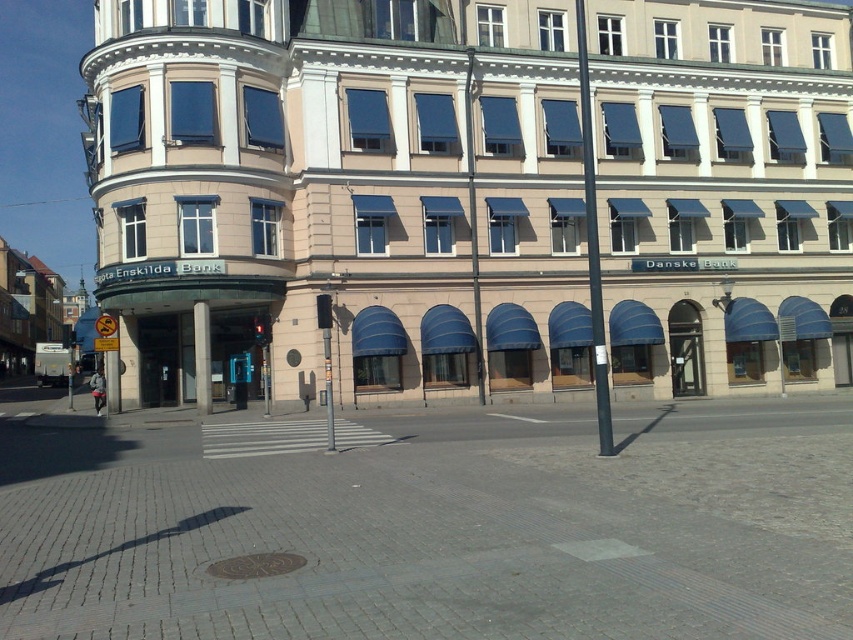
Question: Which point is closer to the camera taking this photo?

Choices:
 (A) (686, 371)
 (B) (697, 554)

Answer: (B)

Question: In this image, where is beige stone building at center located relative to gray concrete sidewalk at center?

Choices:
 (A) above
 (B) below

Answer: (A)

Question: Is beige stone building at center wider than gray concrete sidewalk at center?

Choices:
 (A) yes
 (B) no

Answer: (A)

Question: Does beige stone building at center have a larger size compared to gray concrete sidewalk at center?

Choices:
 (A) yes
 (B) no

Answer: (A)

Question: Which point is farther to the camera?

Choices:
 (A) beige stone building at center
 (B) gray concrete sidewalk at center

Answer: (A)